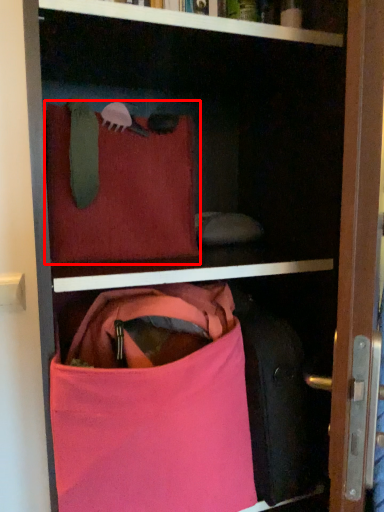
Question: Where is pillow (annotated by the red box) located in relation to handbag in the image?

Choices:
 (A) right
 (B) left

Answer: (B)